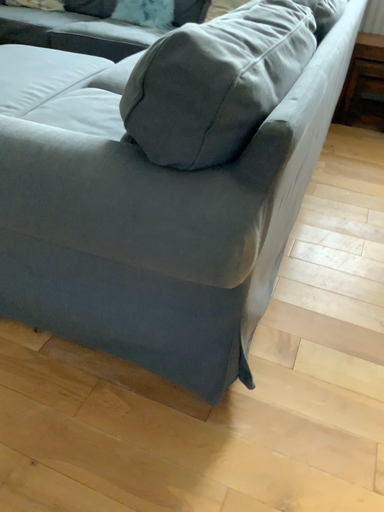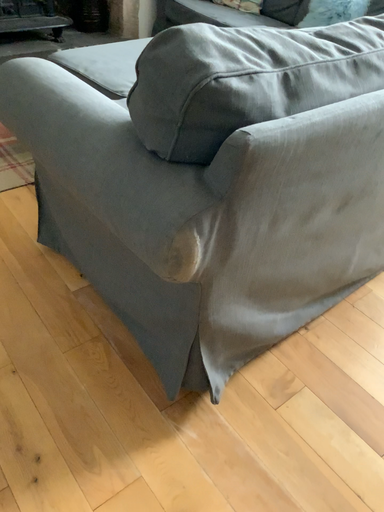
Question: How did the camera likely rotate when shooting the video?

Choices:
 (A) rotated right
 (B) rotated left

Answer: (B)